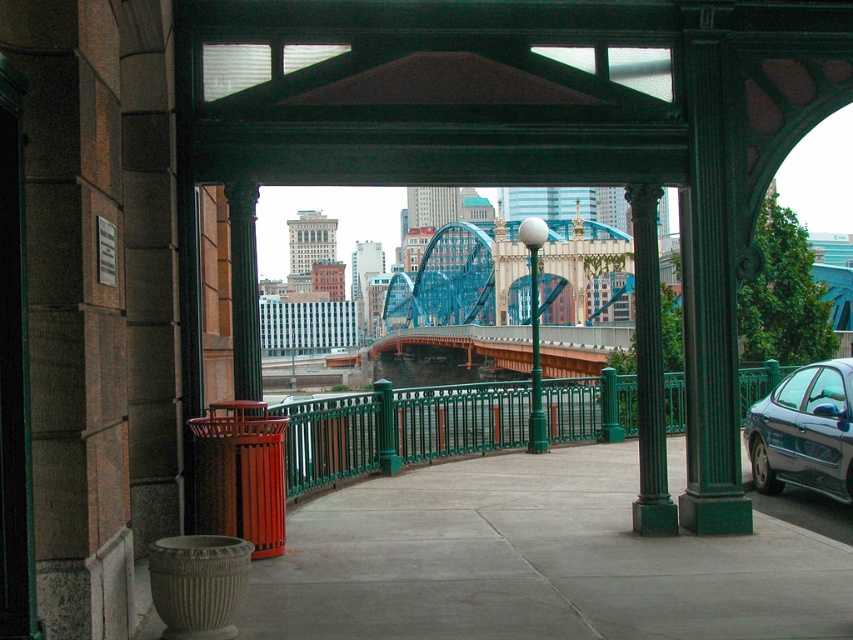
Who is higher up, shiny dark gray sedan at right or green metallic pole at center?

green metallic pole at center

Does point (775, 452) lie in front of point (541, 420)?

Yes, point (775, 452) is in front of point (541, 420).

Find the location of `shiny dark gray sedan at right`. shiny dark gray sedan at right is located at coordinates (804, 432).

Based on the photo, measure the distance from green polished metal pole at center-right to green metallic pole at center.

green polished metal pole at center-right and green metallic pole at center are 5.20 meters apart.

Does green polished metal pole at center-right have a greater width compared to green metallic pole at center?

Indeed, green polished metal pole at center-right has a greater width compared to green metallic pole at center.

I want to click on green polished metal pole at center-right, so click(x=648, y=369).

Can you confirm if shiny dark gray sedan at right is taller than green polished metal pole at center-right?

Incorrect, shiny dark gray sedan at right's height is not larger of green polished metal pole at center-right's.

Can you confirm if shiny dark gray sedan at right is positioned below green polished metal pole at center-right?

Indeed, shiny dark gray sedan at right is positioned under green polished metal pole at center-right.

Identify the location of shiny dark gray sedan at right. (804, 432).